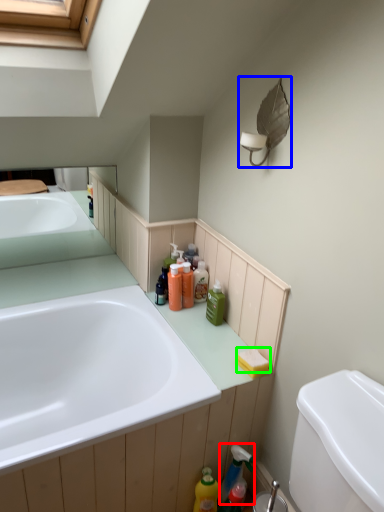
Question: Considering the real-world distances, which object is closest to cleaning product (highlighted by a red box)? light fixture (highlighted by a blue box) or soap (highlighted by a green box).

Choices:
 (A) light fixture
 (B) soap

Answer: (B)